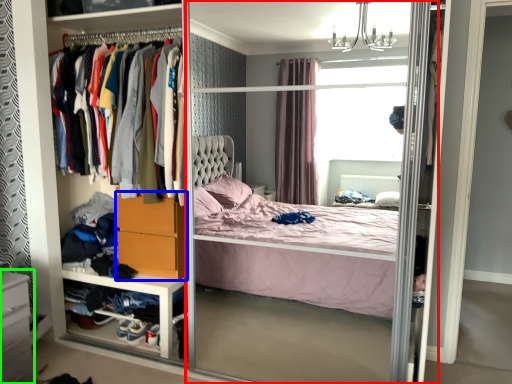
Question: Estimate the real-world distances between objects in this image. Which object is closer to screen door (highlighted by a red box), dresser (highlighted by a blue box) or vanity (highlighted by a green box)?

Choices:
 (A) dresser
 (B) vanity

Answer: (A)